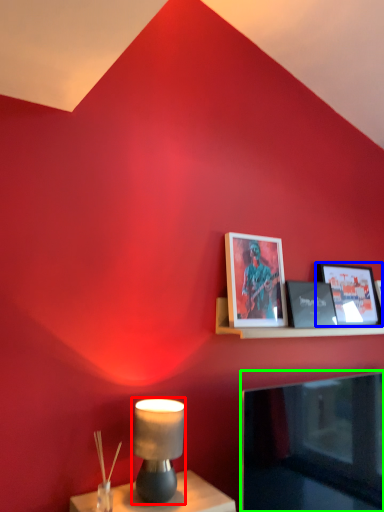
Question: Which object is positioned farthest from table lamp (highlighted by a red box)? Select from picture frame (highlighted by a blue box) and television (highlighted by a green box).

Choices:
 (A) picture frame
 (B) television

Answer: (A)